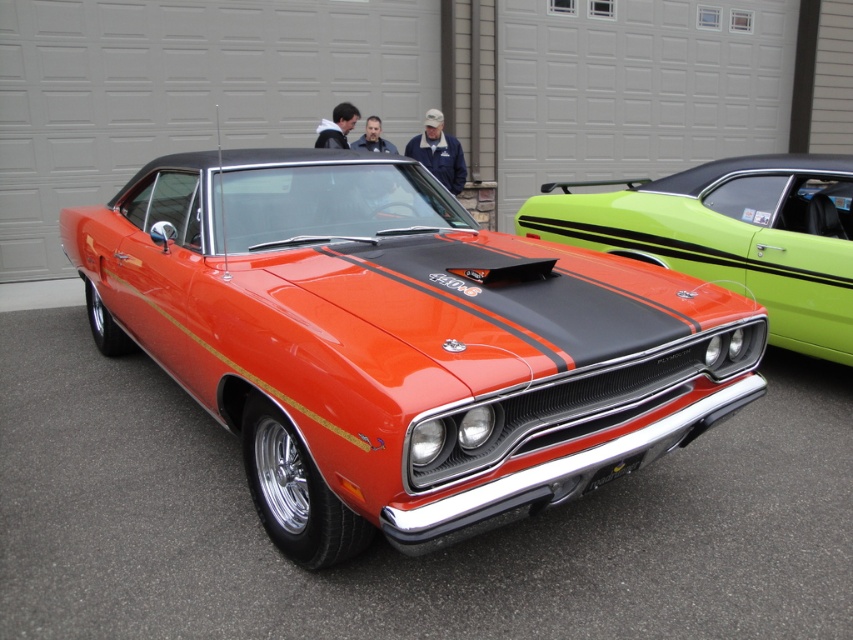
Does point (584, 346) come closer to viewer compared to point (659, 202)?

That is True.

Who is lower down, shiny orange muscle car at center or glossy orange car at center?

Positioned lower is shiny orange muscle car at center.

Find the location of a particular element. This screenshot has width=853, height=640. shiny orange muscle car at center is located at coordinates (399, 342).